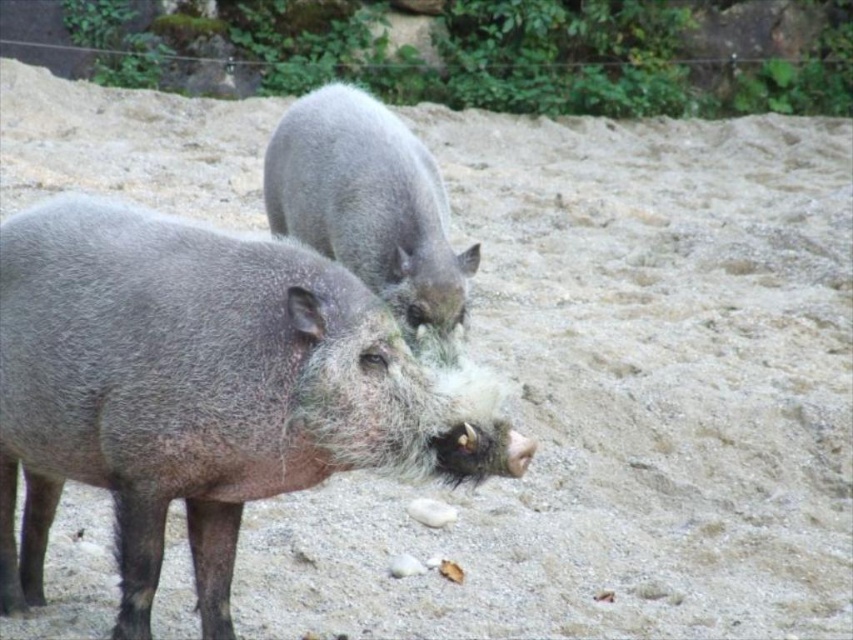
Does gray fuzzy boar at center have a smaller size compared to fuzzy gray pig at center?

Incorrect, gray fuzzy boar at center is not smaller in size than fuzzy gray pig at center.

How distant is gray fuzzy boar at center from fuzzy gray pig at center?

They are 1.19 meters apart.

Between point (96, 246) and point (322, 138), which one is positioned behind?

The point (322, 138) is more distant.

This screenshot has height=640, width=853. Identify the location of gray fuzzy boar at center. (202, 390).